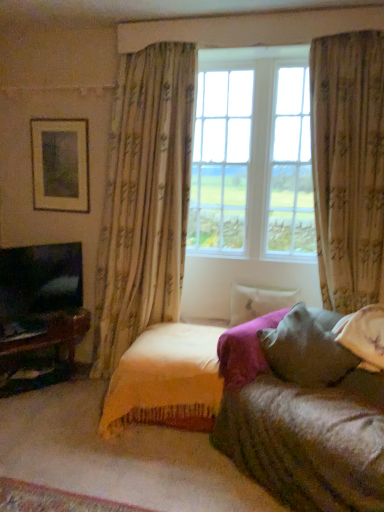
Question: From the image's perspective, is textured beige curtain at right, acting as the first curtain starting from the right, positioned above or below floral fabric curtain at center, which is the first curtain from left to right?

Choices:
 (A) below
 (B) above

Answer: (A)

Question: Is point (314, 69) positioned closer to the camera than point (155, 103)?

Choices:
 (A) farther
 (B) closer

Answer: (B)

Question: Which is farther from the velvet yellow blanket at center?

Choices:
 (A) textured beige curtain at right, acting as the 2th curtain starting from the left
 (B) matte gold picture frame at upper left
 (C) matte black tv at left
 (D) velvety gray pillow at lower right, which ranks as the 1th pillow in front-to-back order
 (E) white soft pillow at center, positioned as the first pillow in back-to-front order

Answer: (B)

Question: Based on their relative distances, which object is nearer to the floral fabric curtain at center, the second curtain positioned from the right?

Choices:
 (A) velvety gray pillow at lower right, which appears as the second pillow when viewed from the back
 (B) white soft pillow at center, the 2th pillow from the front
 (C) matte black tv at left
 (D) matte gold picture frame at upper left
 (E) textured beige curtain at right, acting as the 2th curtain starting from the left

Answer: (D)